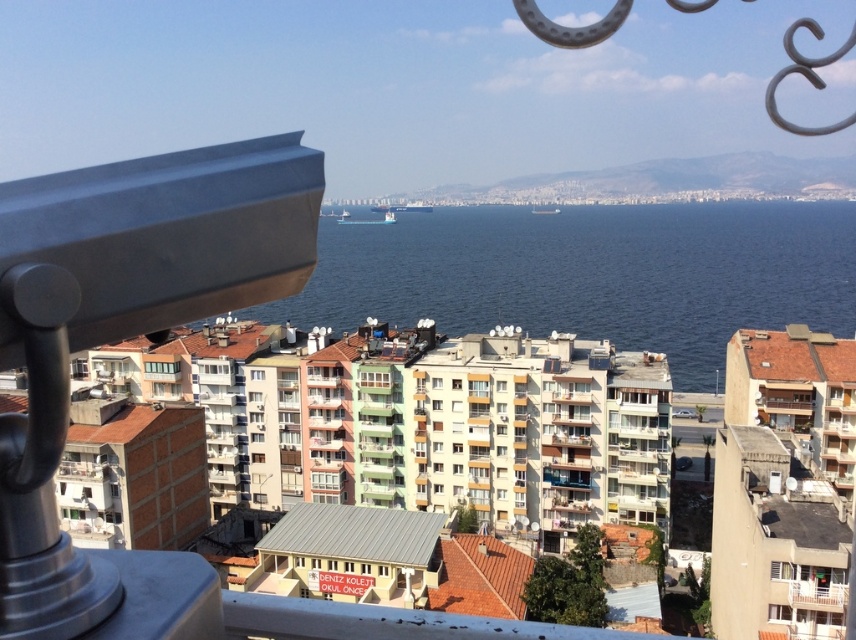
Between metallic gray telescope at left and blue water at center, which one is positioned higher?

blue water at center is higher up.

Between metallic gray telescope at left and blue water at center, which one has more height?

blue water at center

Is point (230, 170) positioned before point (825, 221)?

Yes, point (230, 170) is in front of point (825, 221).

Image resolution: width=856 pixels, height=640 pixels. I want to click on metallic gray telescope at left, so click(x=123, y=337).